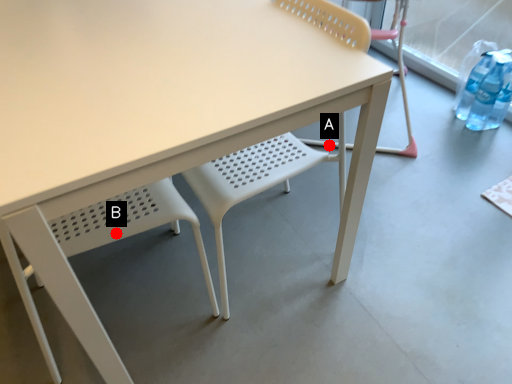
Question: Two points are circled on the image, labeled by A and B beside each circle. Among these points, which one is farthest from the camera?

Choices:
 (A) A is further
 (B) B is further

Answer: (A)